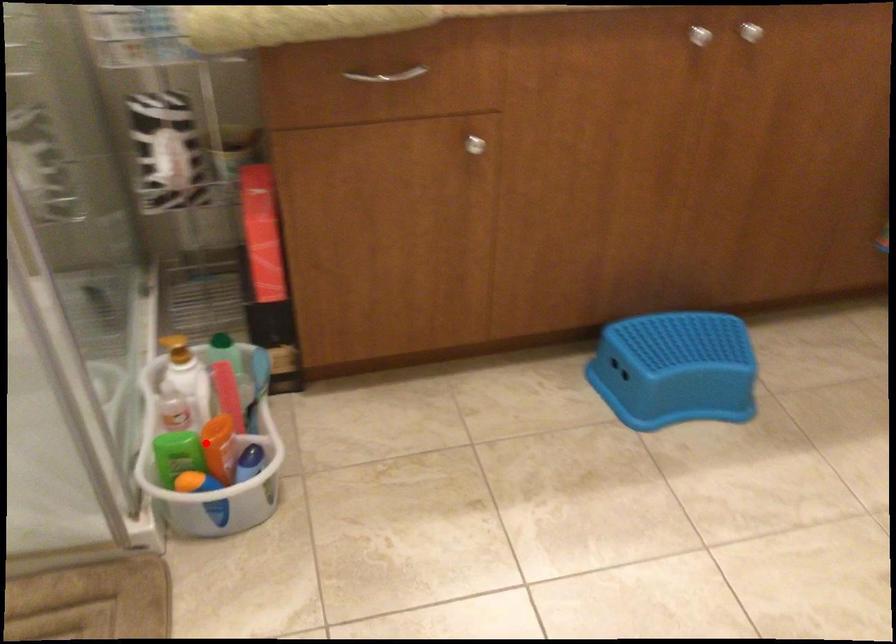
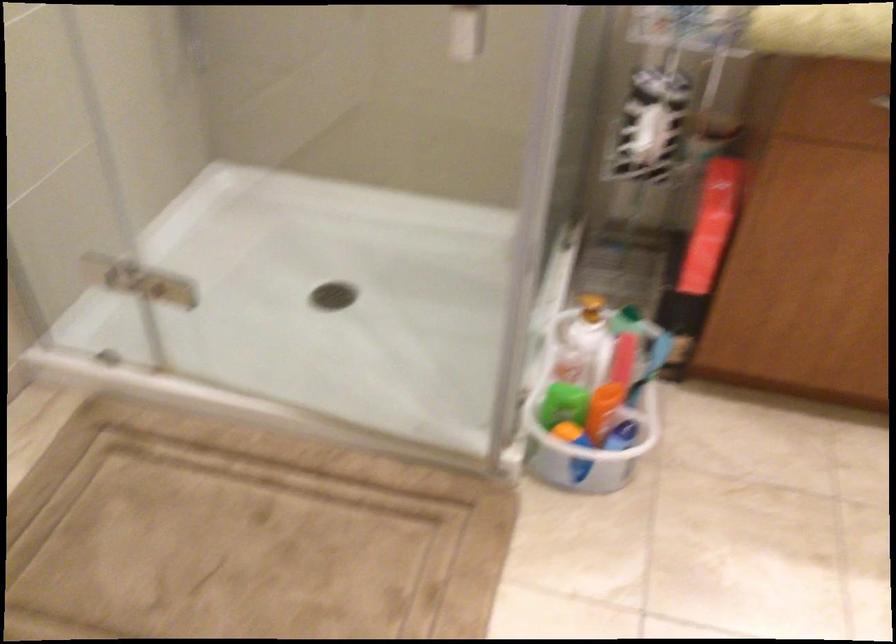
Find the pixel in the second image that matches the highlighted location in the first image.

(595, 397)